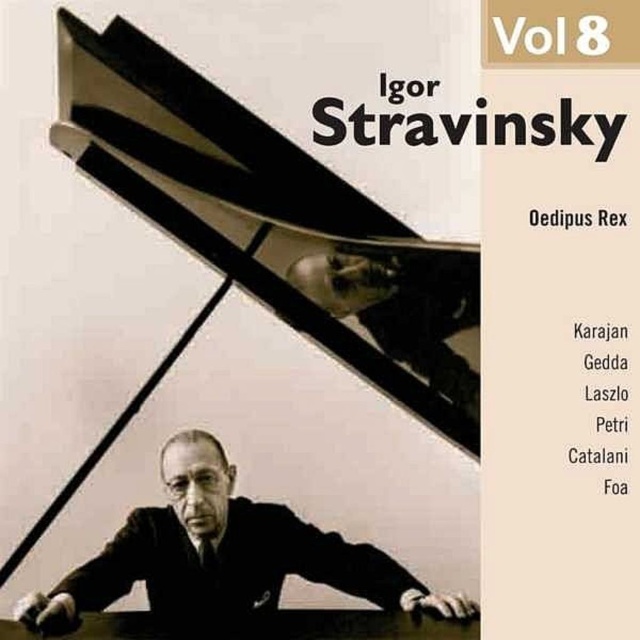
Which is in front, point (109, 83) or point (380, 566)?

Point (109, 83) is more forward.

Between black polished piano at center and black matte suit at center, which one is positioned higher?

black polished piano at center is higher up.

Who is more forward, (176, 557) or (195, 524)?

Point (195, 524)

Find the location of a particular element. black polished piano at center is located at coordinates (273, 221).

Does black polished piano at center have a smaller size compared to matte black conductor at center?

No.

Is point (179, 243) positioned before point (333, 291)?

Yes.

The image size is (640, 640). What do you see at coordinates (273, 221) in the screenshot? I see `black polished piano at center` at bounding box center [273, 221].

Locate an element on the screen. This screenshot has height=640, width=640. black polished piano at center is located at coordinates (273, 221).

Between black matte suit at center and matte black conductor at center, which one has more height?

With more height is black matte suit at center.

Between black matte suit at center and matte black conductor at center, which one is positioned lower?

black matte suit at center is below.

Does point (266, 570) lie in front of point (317, 285)?

No, (266, 570) is behind (317, 285).

Where is `black matte suit at center`? Image resolution: width=640 pixels, height=640 pixels. black matte suit at center is located at coordinates (221, 557).